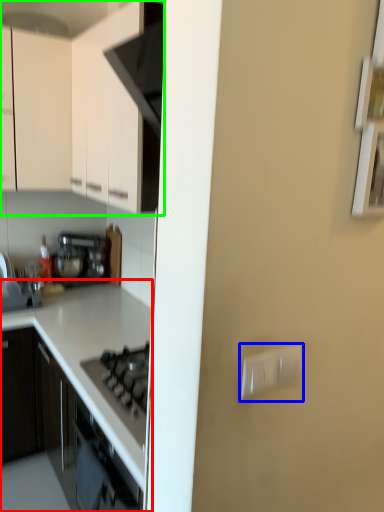
Question: Which object is positioned closest to countertop (highlighted by a red box)? Select from electric outlet (highlighted by a blue box) and cabinetry (highlighted by a green box).

Choices:
 (A) electric outlet
 (B) cabinetry

Answer: (B)